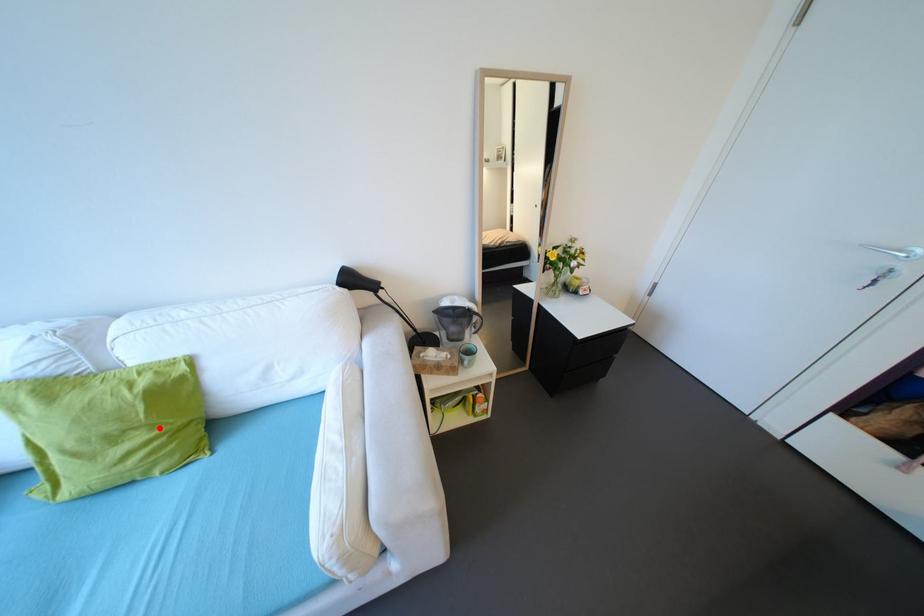
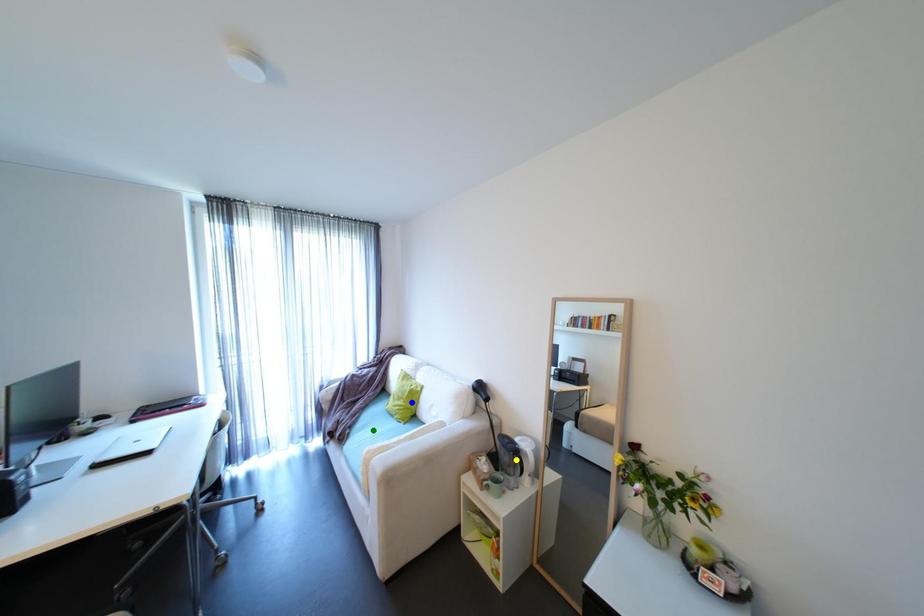
Question: I am providing you with two images of the same scene from different viewpoints. A red point is marked on the first image. You are given multiple points on the second image. Which mark in image 2 goes with the point in image 1?

Choices:
 (A) blue point
 (B) green point
 (C) yellow point

Answer: (A)